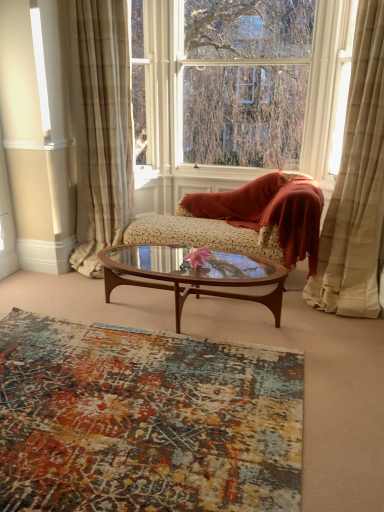
Question: From a real-world perspective, does velvet floral-patterned chaise lounge at center stand above textured multicolored rug at lower center?

Choices:
 (A) yes
 (B) no

Answer: (A)

Question: Is velvet floral-patterned chaise lounge at center turned away from textured multicolored rug at lower center?

Choices:
 (A) yes
 (B) no

Answer: (B)

Question: Can you confirm if velvet floral-patterned chaise lounge at center is bigger than textured multicolored rug at lower center?

Choices:
 (A) yes
 (B) no

Answer: (A)

Question: Does velvet floral-patterned chaise lounge at center have a smaller size compared to textured multicolored rug at lower center?

Choices:
 (A) no
 (B) yes

Answer: (A)

Question: From a real-world perspective, is velvet floral-patterned chaise lounge at center below textured multicolored rug at lower center?

Choices:
 (A) no
 (B) yes

Answer: (A)

Question: From the image's perspective, relative to clear glass window at upper center, is velvet floral-patterned chaise lounge at center above or below?

Choices:
 (A) below
 (B) above

Answer: (A)

Question: Is velvet floral-patterned chaise lounge at center in front of or behind clear glass window at upper center in the image?

Choices:
 (A) behind
 (B) front

Answer: (B)

Question: Considering the positions of point (132, 224) and point (314, 57), is point (132, 224) closer or farther from the camera than point (314, 57)?

Choices:
 (A) farther
 (B) closer

Answer: (A)

Question: In terms of height, does velvet floral-patterned chaise lounge at center look taller or shorter compared to clear glass window at upper center?

Choices:
 (A) tall
 (B) short

Answer: (B)

Question: From the image's perspective, relative to clear glass window at upper center, is beige plaid curtain at left, the first curtain from the left, above or below?

Choices:
 (A) below
 (B) above

Answer: (A)

Question: Visually, is beige plaid curtain at left, the first curtain from the left, positioned to the left or to the right of clear glass window at upper center?

Choices:
 (A) left
 (B) right

Answer: (A)

Question: Would you say beige plaid curtain at left, which is the second curtain from right to left, is inside or outside clear glass window at upper center?

Choices:
 (A) inside
 (B) outside

Answer: (B)

Question: Considering the positions of beige plaid curtain at left, the first curtain from the left, and clear glass window at upper center in the image, is beige plaid curtain at left, the first curtain from the left, wider or thinner than clear glass window at upper center?

Choices:
 (A) thin
 (B) wide

Answer: (B)

Question: Is beige textured curtain at right, acting as the second curtain starting from the left, wider or thinner than velvet floral-patterned chaise lounge at center?

Choices:
 (A) wide
 (B) thin

Answer: (A)

Question: In the image, is beige textured curtain at right, which is the first curtain in right-to-left order, on the left side or the right side of velvet floral-patterned chaise lounge at center?

Choices:
 (A) right
 (B) left

Answer: (A)